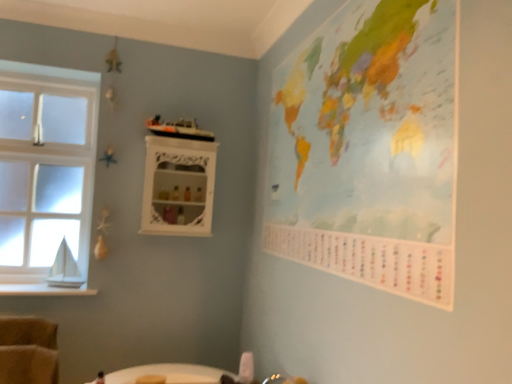
Question: Is painted paper map at upper right outside white glossy cabinet at upper center?

Choices:
 (A) no
 (B) yes

Answer: (B)

Question: Is the position of painted paper map at upper right more distant than that of white glossy cabinet at upper center?

Choices:
 (A) yes
 (B) no

Answer: (B)

Question: Can you confirm if painted paper map at upper right is positioned to the right of white glossy cabinet at upper center?

Choices:
 (A) no
 (B) yes

Answer: (B)

Question: Does painted paper map at upper right have a smaller size compared to white glossy cabinet at upper center?

Choices:
 (A) yes
 (B) no

Answer: (B)

Question: Can you confirm if painted paper map at upper right is wider than white glossy cabinet at upper center?

Choices:
 (A) no
 (B) yes

Answer: (A)

Question: Is clear glass window at left inside or outside of painted paper map at upper right?

Choices:
 (A) inside
 (B) outside

Answer: (B)

Question: Is clear glass window at left taller or shorter than painted paper map at upper right?

Choices:
 (A) short
 (B) tall

Answer: (B)

Question: From the image's perspective, is clear glass window at left above or below painted paper map at upper right?

Choices:
 (A) above
 (B) below

Answer: (B)

Question: Considering the positions of point (82, 107) and point (339, 160), is point (82, 107) closer or farther from the camera than point (339, 160)?

Choices:
 (A) closer
 (B) farther

Answer: (B)

Question: From a real-world perspective, is white wood at left above or below clear glass window at left?

Choices:
 (A) above
 (B) below

Answer: (B)

Question: Considering their positions, is white wood at left located in front of or behind clear glass window at left?

Choices:
 (A) front
 (B) behind

Answer: (A)

Question: In terms of size, does white wood at left appear bigger or smaller than clear glass window at left?

Choices:
 (A) small
 (B) big

Answer: (A)

Question: Is point (64, 288) positioned closer to the camera than point (84, 71)?

Choices:
 (A) closer
 (B) farther

Answer: (A)

Question: From the image's perspective, is white wood at left positioned above or below painted paper map at upper right?

Choices:
 (A) above
 (B) below

Answer: (B)

Question: Is white wood at left wider or thinner than painted paper map at upper right?

Choices:
 (A) thin
 (B) wide

Answer: (B)